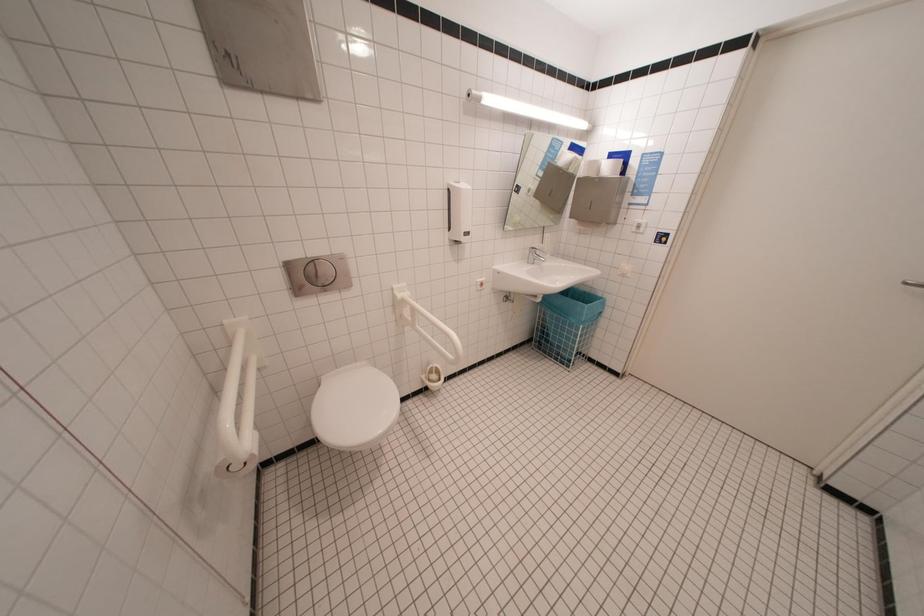
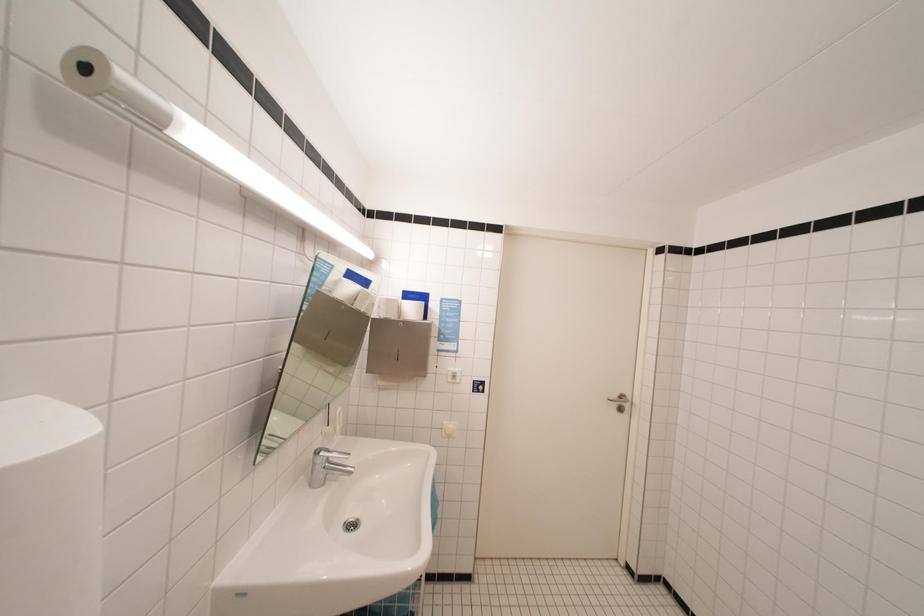
Question: The first image is from the beginning of the video and the second image is from the end. How did the camera likely rotate when shooting the video?

Choices:
 (A) Left
 (B) Right
 (C) Up
 (D) Down

Answer: (B)